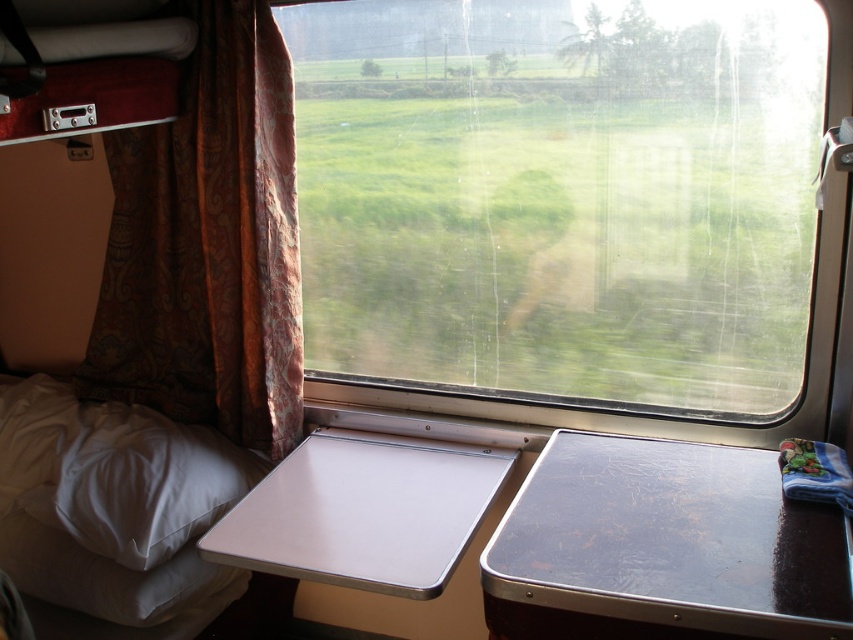
You are a passenger sitting in the train cabin and want to check the view outside the window. Since the brown patterned curtain at left and the white soft bed at lower left are in your way, which object is closer to you so you can decide to move it first?

The brown patterned curtain at left is positioned on the right side of white soft bed at lower left, meaning the white soft bed at lower left is closer to you. Therefore, you should move the white soft bed at lower left first to access the window.

You are inside the train cabin and want to know if the point at coordinate (468, 65) is closer to the window than the point at coordinate (163, 618). Can you determine this based on their positions?

Point (468, 65) is behind point (163, 618), so it is farther away from the window. Therefore, the point at (163, 618) is closer to the window than the point at (468, 65).